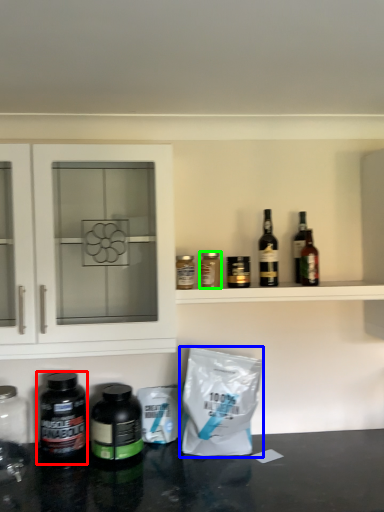
Question: Which object is the closest to the bottle (highlighted by a red box)? Choose among these: material (highlighted by a blue box) or bottle (highlighted by a green box).

Choices:
 (A) material
 (B) bottle

Answer: (A)